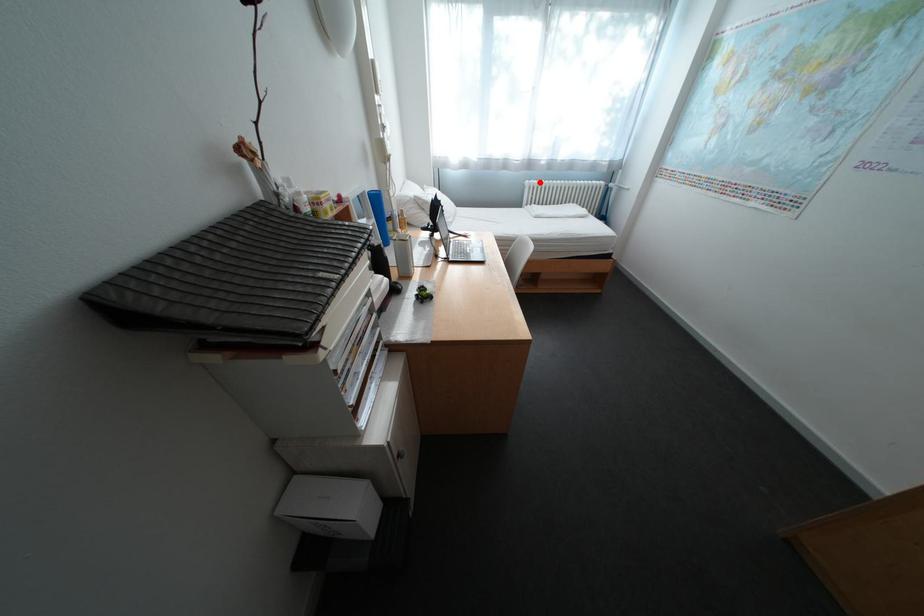
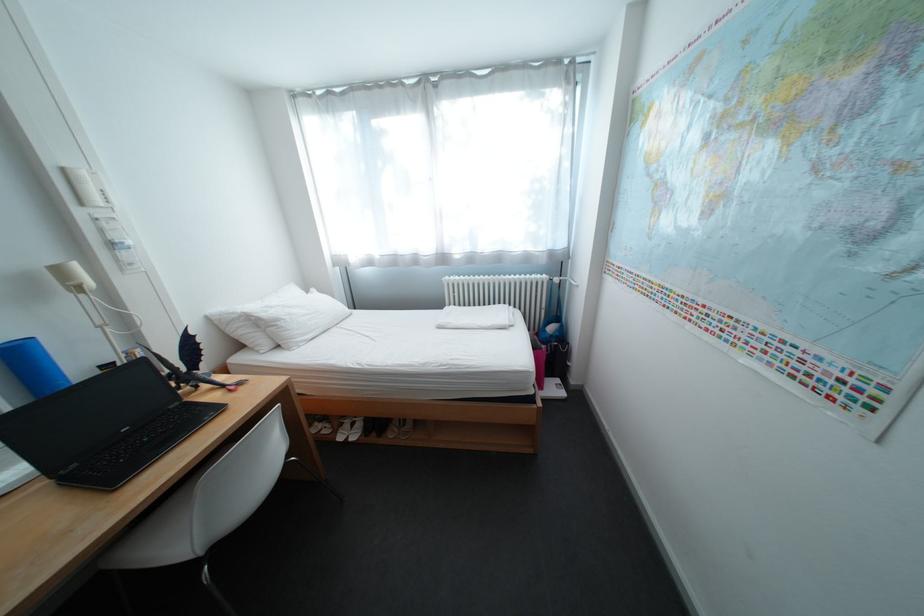
In the second image, find the point that corresponds to the highlighted location in the first image.

(459, 278)